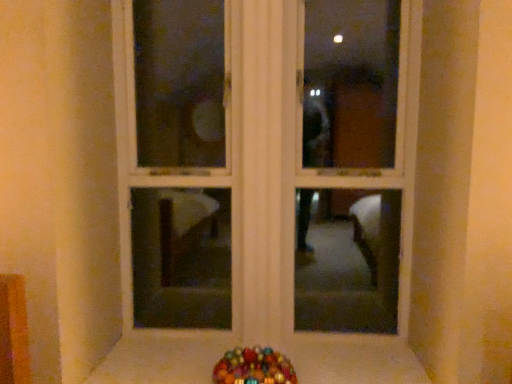
Question: In terms of width, does white wood window frame at center look wider or thinner when compared to smooth white surface at lower center?

Choices:
 (A) thin
 (B) wide

Answer: (A)

Question: In the image, is white wood window frame at center positioned in front of or behind smooth white surface at lower center?

Choices:
 (A) behind
 (B) front

Answer: (A)

Question: Which object is the farthest from the smooth white surface at lower center?

Choices:
 (A) white wood window frame at center
 (B) glossy plastic candy at lower center

Answer: (A)

Question: Considering the real-world distances, which object is closest to the glossy plastic candy at lower center?

Choices:
 (A) smooth white surface at lower center
 (B) white wood window frame at center

Answer: (A)